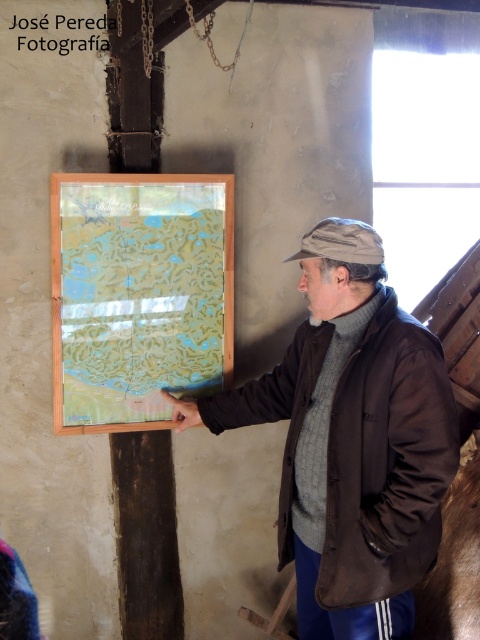
Is point (392, 620) farther from viewer compared to point (191, 275)?

No, (392, 620) is in front of (191, 275).

Who is positioned more to the right, matte brown jacket at center or translucent paper map at center?

matte brown jacket at center

What do you see at coordinates (351, 440) in the screenshot?
I see `matte brown jacket at center` at bounding box center [351, 440].

This screenshot has height=640, width=480. Identify the location of matte brown jacket at center. (351, 440).